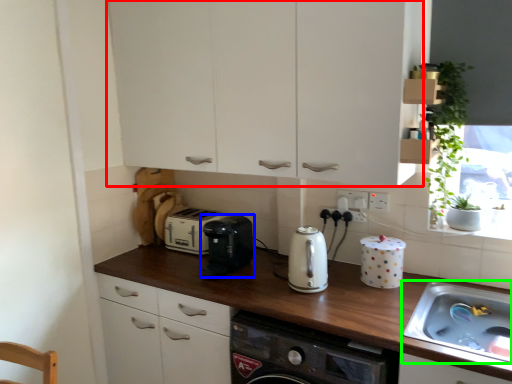
Question: Which object is positioned closest to cabinetry (highlighted by a red box)? Select from kitchen appliance (highlighted by a blue box) and sink (highlighted by a green box).

Choices:
 (A) kitchen appliance
 (B) sink

Answer: (A)